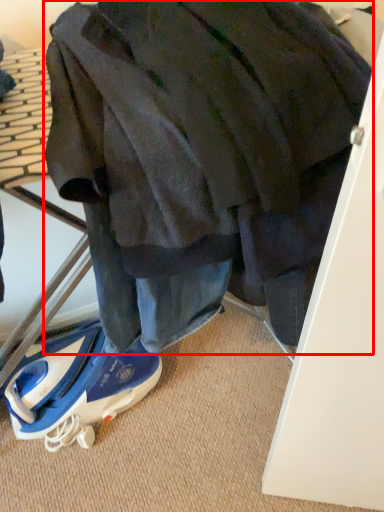
Question: From the image's perspective, considering the relative positions of jacket (annotated by the red box) and footwear in the image provided, where is jacket (annotated by the red box) located with respect to the staircase?

Choices:
 (A) below
 (B) above

Answer: (B)